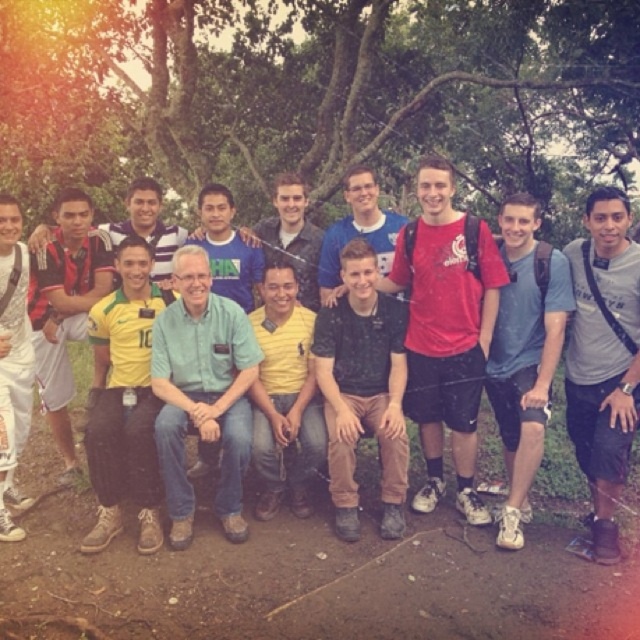
Which is in front, point (408, 413) or point (508, 227)?

Point (508, 227) is in front.

Is point (442, 248) farther from camera compared to point (548, 294)?

Yes, it is.

Who is more distant from viewer, (410, 312) or (525, 410)?

Positioned behind is point (410, 312).

At what (x,y) coordinates should I click in order to perform the action: click on matte red t-shirt at center. Please return your answer as a coordinate pair (x, y). Looking at the image, I should click on (445, 330).

Does point (401, 288) lie behind point (330, 324)?

That is True.

Between matte red t-shirt at center and dark brown leather pants at center, which one is positioned lower?

Positioned lower is dark brown leather pants at center.

The image size is (640, 640). In order to click on matte red t-shirt at center in this screenshot , I will do `click(445, 330)`.

In order to click on matte red t-shirt at center in this screenshot , I will do `click(445, 330)`.

I want to click on dark brown leather pants at center, so click(362, 388).